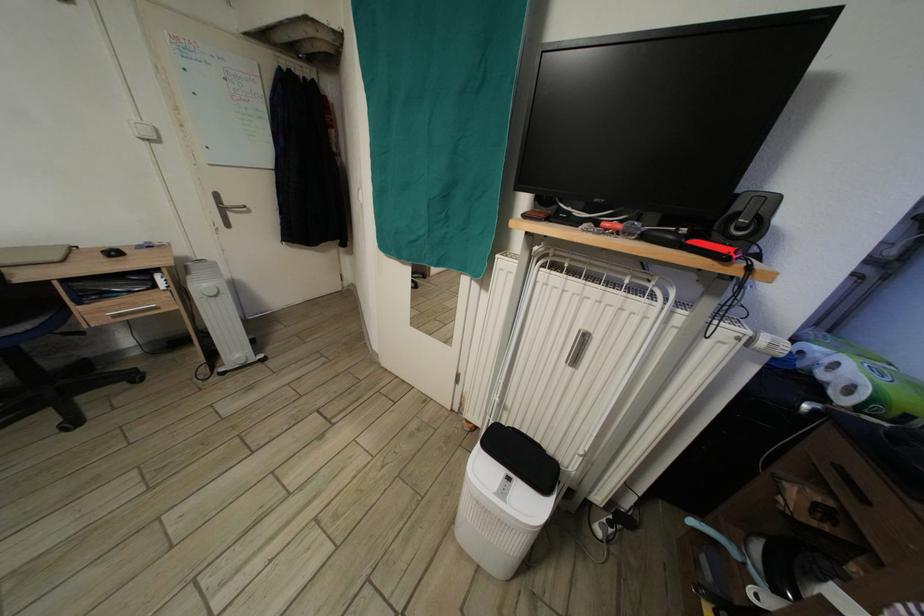
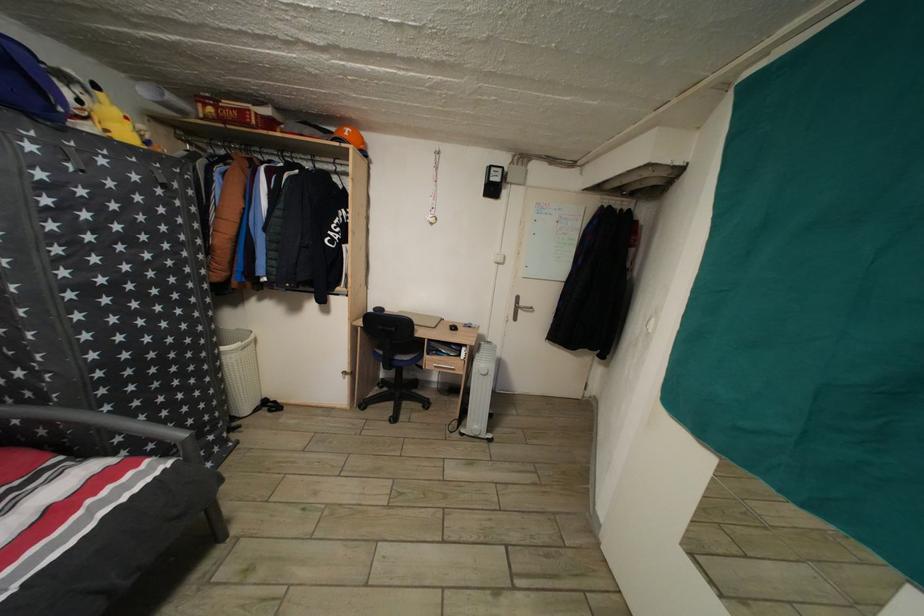
Locate, in the second image, the point that corresponds to (235,209) in the first image.

(529, 310)